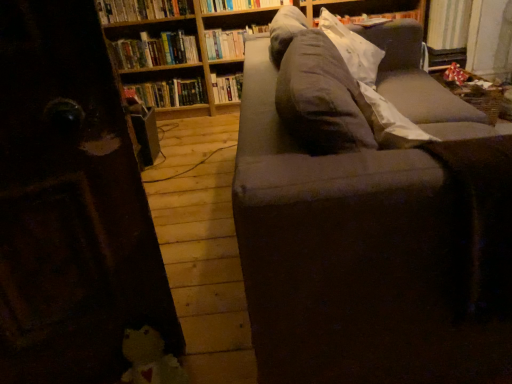
Question: Is fluffy white plush at lower left taller or shorter than gray fabric pillow at upper right?

Choices:
 (A) tall
 (B) short

Answer: (B)

Question: Is fluffy white plush at lower left inside the boundaries of gray fabric pillow at upper right, or outside?

Choices:
 (A) outside
 (B) inside

Answer: (A)

Question: Based on their relative distances, which object is nearer to the hardcover book at center, arranged as the sixth book when viewed from the top?

Choices:
 (A) gray fabric pillow at upper right
 (B) dark gray fabric couch at center
 (C) hardcover book at upper center, the first book in the top-to-bottom sequence
 (D) wooden bookcase at upper center
 (E) hardcover book at upper center, which is the 5th book from top to bottom

Answer: (D)

Question: Which is farther from the hardcover book at center, arranged as the sixth book when viewed from the top?

Choices:
 (A) hardcover book at upper center, the first book in the top-to-bottom sequence
 (B) fluffy white plush at lower left
 (C) hardcover books at upper left, the second book from the top
 (D) hardcover book at upper center, the 4th book in the bottom-to-top sequence
 (E) gray fabric pillow at upper right

Answer: (B)